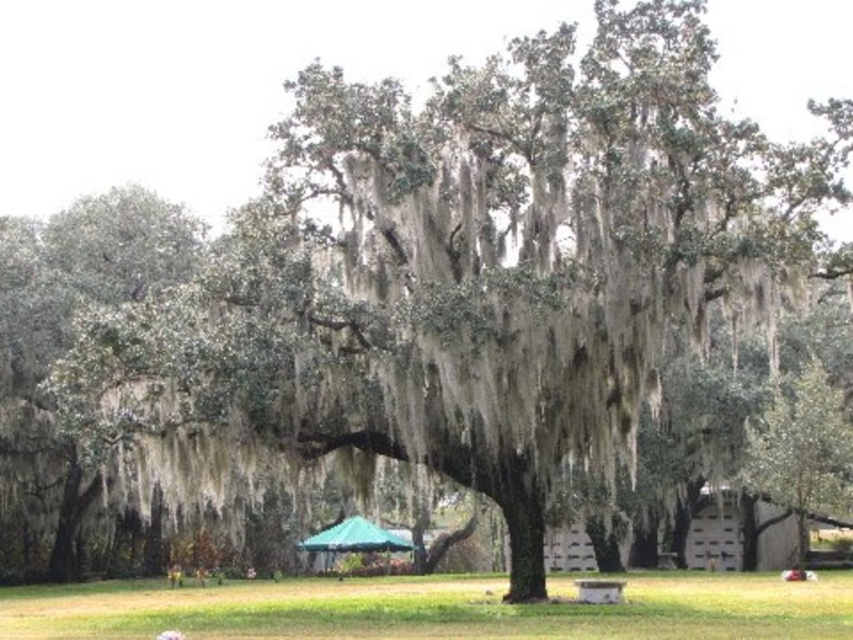
Question: Can you confirm if green mossy tree at center is positioned to the right of green fabric canopy at center?

Choices:
 (A) yes
 (B) no

Answer: (A)

Question: Based on their relative distances, which object is nearer to the green fabric canopy at center?

Choices:
 (A) green mossy tree at center
 (B) wooden park bench at center

Answer: (B)

Question: Which point is farther to the camera?

Choices:
 (A) wooden park bench at center
 (B) green fabric canopy at center

Answer: (B)

Question: Observing the image, what is the correct spatial positioning of green mossy tree at center in reference to green fabric canopy at center?

Choices:
 (A) right
 (B) left

Answer: (A)

Question: Considering the relative positions of green fabric canopy at center and wooden park bench at center in the image provided, where is green fabric canopy at center located with respect to wooden park bench at center?

Choices:
 (A) right
 (B) left

Answer: (B)

Question: Which point is farther to the camera?

Choices:
 (A) wooden park bench at center
 (B) green fabric canopy at center
 (C) green mossy tree at center

Answer: (B)